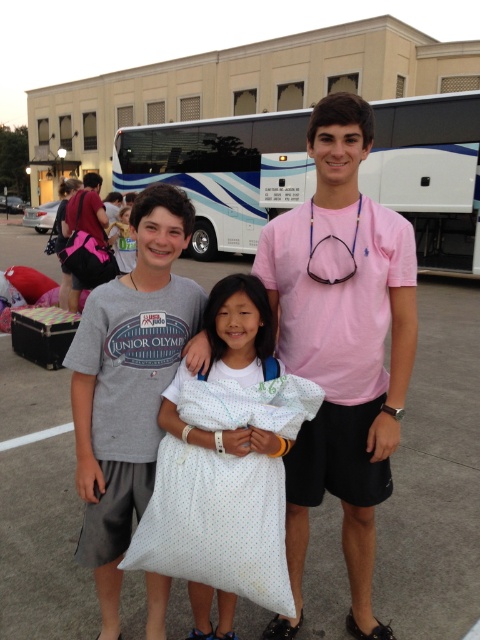
Can you confirm if white glossy bus at upper center is wider than pink fabric backpack at left?

Incorrect, white glossy bus at upper center's width does not surpass pink fabric backpack at left's.

Does white glossy bus at upper center lie behind pink fabric backpack at left?

Yes, it is.

Between point (431, 204) and point (88, 189), which one is positioned in front?

Point (88, 189) is in front.

Image resolution: width=480 pixels, height=640 pixels. In order to click on white glossy bus at upper center in this screenshot , I will do `click(223, 172)`.

Is matte pink backpack at center taller than pink fabric backpack at left?

No.

Between point (129, 272) and point (68, 202), which one is positioned behind?

The point (129, 272) is behind.

In order to click on matte pink backpack at center in this screenshot , I will do coord(122,241).

What do you see at coordinates (342, 348) in the screenshot?
I see `pink cotton t-shirt at center` at bounding box center [342, 348].

The image size is (480, 640). Identify the location of pink cotton t-shirt at center. (342, 348).